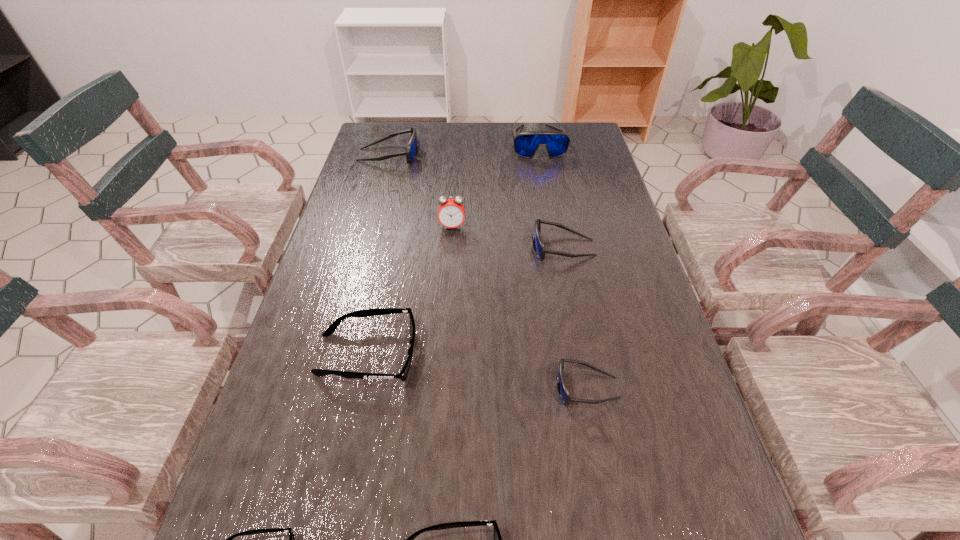
Locate which object ranks seventh in proximity to the red alarm clock. Please provide its 2D coordinates. Your answer should be formatted as a tuple, i.e. [(x, y)], where the tuple contains the x and y coordinates of a point satisfying the conditions above.

[(291, 535)]

Where is `sunglasses object that ranks as the third closest to the third smallest blue sunglasses`? The image size is (960, 540). sunglasses object that ranks as the third closest to the third smallest blue sunglasses is located at coordinates (330, 330).

Identify which sunglasses is the fifth nearest to the tallest sunglasses. Please provide its 2D coordinates. Your answer should be formatted as a tuple, i.e. [(x, y)], where the tuple contains the x and y coordinates of a point satisfying the conditions above.

[(497, 536)]

You are a GUI agent. You are given a task and a screenshot of the screen. Output one action in this format:
    pyautogui.click(x=<x>, y=<y>)
    Task: Click on the fourth closest blue sunglasses to the shortest sunglasses
    
    Given the screenshot: What is the action you would take?
    pyautogui.click(x=526, y=144)

Select which blue sunglasses is the second closest to the sixth shortest object. Please provide its 2D coordinates. Your answer should be formatted as a tuple, i.e. [(x, y)], where the tuple contains the x and y coordinates of a point satisfying the conditions above.

[(538, 245)]

You are a GUI agent. You are given a task and a screenshot of the screen. Output one action in this format:
    pyautogui.click(x=<x>, y=<y>)
    Task: Click on the third closest black sunglasses to the second nearest blue sunglasses
    The width and height of the screenshot is (960, 540).
    Given the screenshot: What is the action you would take?
    pyautogui.click(x=291, y=535)

Identify which black sunglasses is the third closest to the second biggest blue sunglasses. Please provide its 2D coordinates. Your answer should be formatted as a tuple, i.e. [(x, y)], where the tuple contains the x and y coordinates of a point satisfying the conditions above.

[(291, 535)]

The image size is (960, 540). Identify the location of free point that satisfies the following two spatial constraints: 1. on the front-facing side of the tallest sunglasses; 2. on the front-facing side of the biggest black sunglasses. (576, 355).

Where is `blank area in the image that satisfies the following two spatial constraints: 1. on the front-facing side of the red alarm clock; 2. on the front-facing side of the farthest black sunglasses`? This screenshot has width=960, height=540. blank area in the image that satisfies the following two spatial constraints: 1. on the front-facing side of the red alarm clock; 2. on the front-facing side of the farthest black sunglasses is located at coordinates (444, 355).